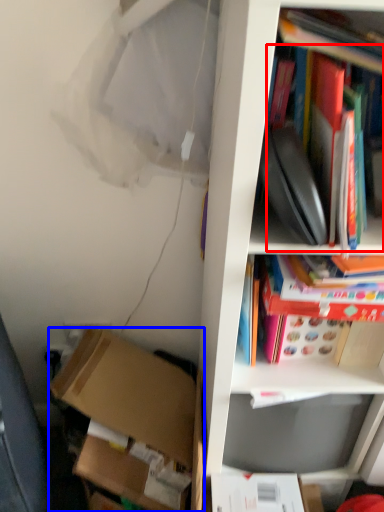
Question: Which object is further to the camera taking this photo, book (highlighted by a red box) or box (highlighted by a blue box)?

Choices:
 (A) book
 (B) box

Answer: (B)